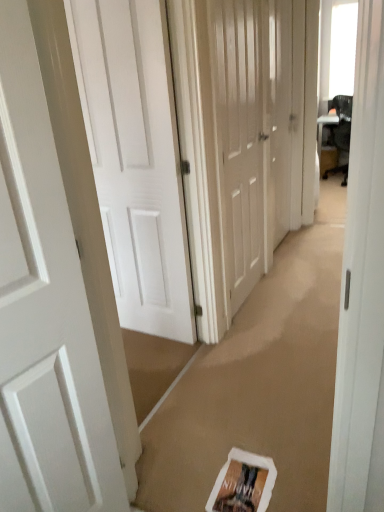
Question: Can you confirm if white matte door at center, arranged as the 2th door when viewed from the left, is bigger than white matte door at center, positioned as the 3th door in left-to-right order?

Choices:
 (A) no
 (B) yes

Answer: (B)

Question: Are white matte door at center, which is the 3th door in right-to-left order, and white matte door at center, placed as the second door when sorted from right to left, located far from each other?

Choices:
 (A) yes
 (B) no

Answer: (B)

Question: Can we say white matte door at center, which is the 3th door in right-to-left order, lies outside white matte door at center, positioned as the 3th door in left-to-right order?

Choices:
 (A) no
 (B) yes

Answer: (B)

Question: Is white matte door at center, which is the 3th door in right-to-left order, wider than white matte door at center, placed as the second door when sorted from right to left?

Choices:
 (A) yes
 (B) no

Answer: (A)

Question: From a real-world perspective, is white matte door at center, arranged as the 2th door when viewed from the left, physically above white matte door at center, placed as the second door when sorted from right to left?

Choices:
 (A) no
 (B) yes

Answer: (A)

Question: From the image's perspective, relative to white matte door at left, the fourth door positioned from the right, is white glossy door at center, acting as the fourth door starting from the left, above or below?

Choices:
 (A) above
 (B) below

Answer: (A)

Question: Is point (284, 80) closer or farther from the camera than point (31, 233)?

Choices:
 (A) closer
 (B) farther

Answer: (B)

Question: In terms of size, does white glossy door at center, positioned as the 1th door in right-to-left order, appear bigger or smaller than white matte door at left, the fourth door positioned from the right?

Choices:
 (A) small
 (B) big

Answer: (B)

Question: In terms of width, does white glossy door at center, positioned as the 1th door in right-to-left order, look wider or thinner when compared to white matte door at left, the fourth door positioned from the right?

Choices:
 (A) thin
 (B) wide

Answer: (A)

Question: In the image, is white matte door at left, the fourth door positioned from the right, on the left side or the right side of white matte door at center, placed as the second door when sorted from right to left?

Choices:
 (A) right
 (B) left

Answer: (B)

Question: From their relative heights in the image, would you say white matte door at left, the fourth door positioned from the right, is taller or shorter than white matte door at center, placed as the second door when sorted from right to left?

Choices:
 (A) short
 (B) tall

Answer: (A)

Question: In terms of width, does white matte door at left, the fourth door positioned from the right, look wider or thinner when compared to white matte door at center, positioned as the 3th door in left-to-right order?

Choices:
 (A) thin
 (B) wide

Answer: (B)

Question: Does point (16, 263) appear closer or farther from the camera than point (231, 31)?

Choices:
 (A) closer
 (B) farther

Answer: (A)

Question: Considering their positions, is white matte door at center, arranged as the 2th door when viewed from the left, located in front of or behind white glossy door at center, acting as the fourth door starting from the left?

Choices:
 (A) behind
 (B) front

Answer: (B)

Question: From the image's perspective, is white matte door at center, which is the 3th door in right-to-left order, above or below white glossy door at center, positioned as the 1th door in right-to-left order?

Choices:
 (A) above
 (B) below

Answer: (B)